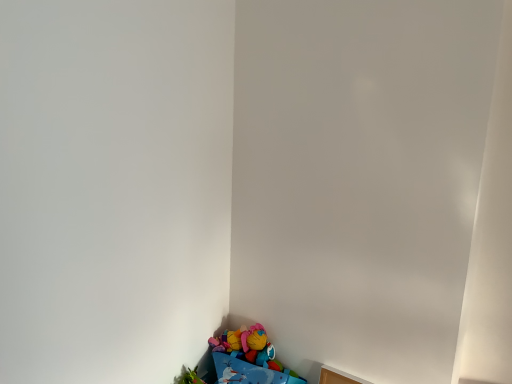
Describe the element at coordinates (249, 358) in the screenshot. Image resolution: width=512 pixels, height=384 pixels. I see `soft plush toy at bottom left` at that location.

The height and width of the screenshot is (384, 512). I want to click on soft plush toy at bottom left, so click(x=249, y=358).

Identify the location of soft plush toy at bottom left. This screenshot has height=384, width=512. (249, 358).